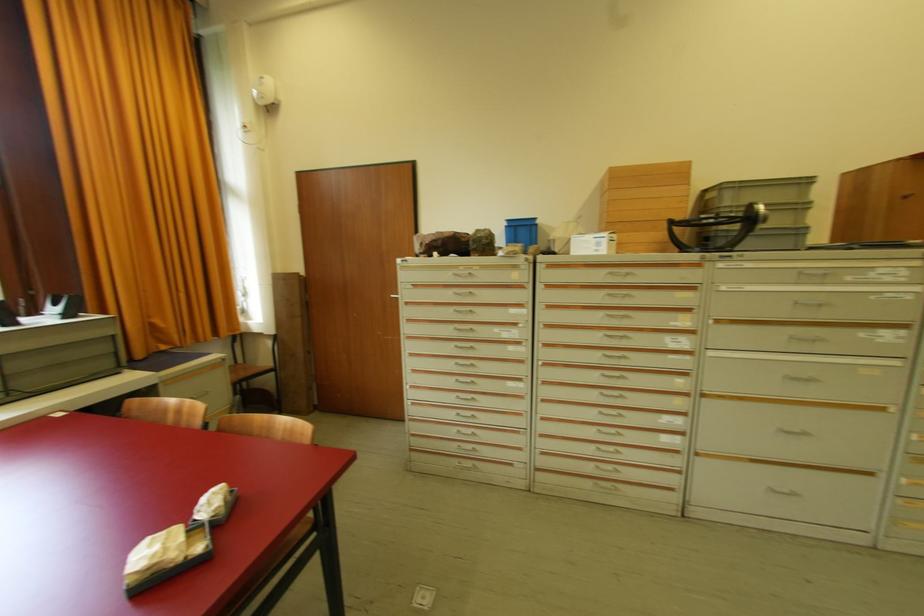
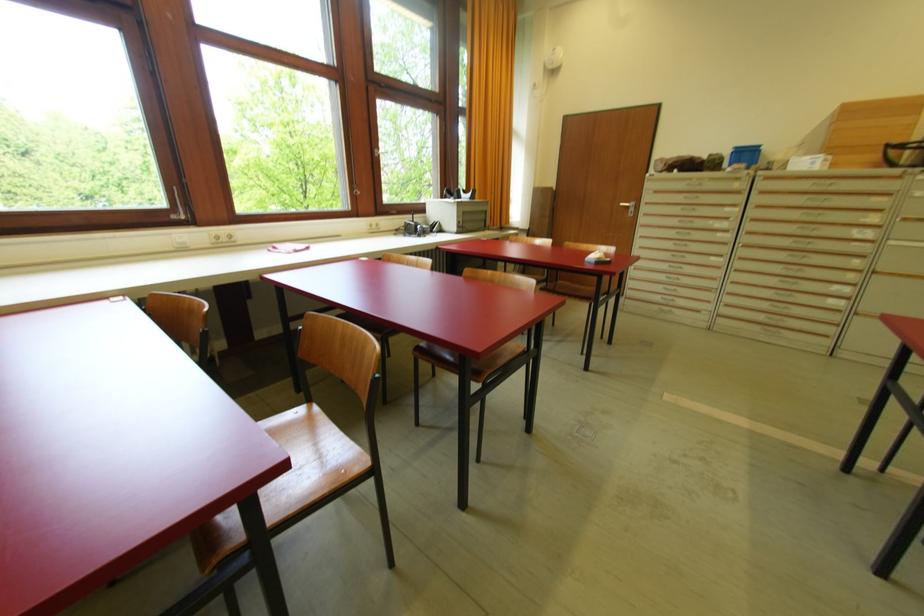
Where in the second image is the point corresponding to (610,273) from the first image?

(817, 183)